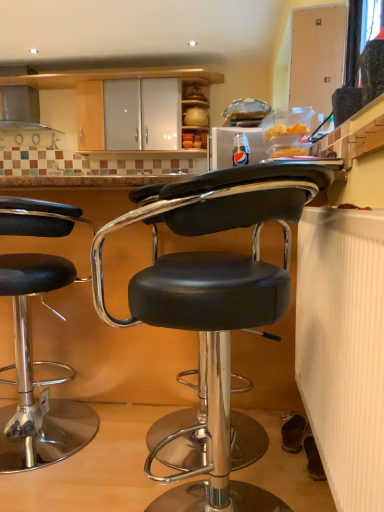
Question: Is black leather stool at left, which is the 1th chair in back-to-front order, to the left of satin silver exhaust hood at upper left from the viewer's perspective?

Choices:
 (A) yes
 (B) no

Answer: (B)

Question: Can you confirm if black leather stool at left, which is the 1th chair in back-to-front order, is shorter than satin silver exhaust hood at upper left?

Choices:
 (A) no
 (B) yes

Answer: (A)

Question: Could you tell me if black leather stool at left, acting as the 2th chair starting from the right, is turned towards satin silver exhaust hood at upper left?

Choices:
 (A) no
 (B) yes

Answer: (A)

Question: Is black leather stool at left, which ranks as the 2th chair in front-to-back order, far away from satin silver exhaust hood at upper left?

Choices:
 (A) yes
 (B) no

Answer: (A)

Question: Is black leather stool at left, which is the 1th chair in back-to-front order, looking in the opposite direction of satin silver exhaust hood at upper left?

Choices:
 (A) no
 (B) yes

Answer: (A)

Question: From a real-world perspective, does black leather stool at left, which ranks as the 2th chair in front-to-back order, stand above satin silver exhaust hood at upper left?

Choices:
 (A) yes
 (B) no

Answer: (B)

Question: Is black leather stool at center, which is the 2th chair from left to right, turned away from black leather stool at left, placed as the 1th chair when sorted from left to right?

Choices:
 (A) yes
 (B) no

Answer: (B)

Question: From the image's perspective, does black leather stool at center, which is the 1th chair in right-to-left order, appear lower than black leather stool at left, placed as the 1th chair when sorted from left to right?

Choices:
 (A) no
 (B) yes

Answer: (B)

Question: Are black leather stool at center, arranged as the 1th chair when viewed from the front, and black leather stool at left, acting as the 2th chair starting from the right, located far from each other?

Choices:
 (A) yes
 (B) no

Answer: (B)

Question: Could you tell me if black leather stool at center, which is the 2th chair from left to right, is facing black leather stool at left, acting as the 2th chair starting from the right?

Choices:
 (A) yes
 (B) no

Answer: (B)

Question: Is black leather stool at center, which is the 1th chair in right-to-left order, in front of black leather stool at left, which ranks as the 2th chair in front-to-back order?

Choices:
 (A) yes
 (B) no

Answer: (A)

Question: Can we say black leather stool at center, arranged as the 1th chair when viewed from the front, lies outside black leather stool at left, which ranks as the 2th chair in front-to-back order?

Choices:
 (A) no
 (B) yes

Answer: (B)

Question: Is black leather stool at center, which is the 1th chair in right-to-left order, not within satin silver exhaust hood at upper left?

Choices:
 (A) no
 (B) yes

Answer: (B)